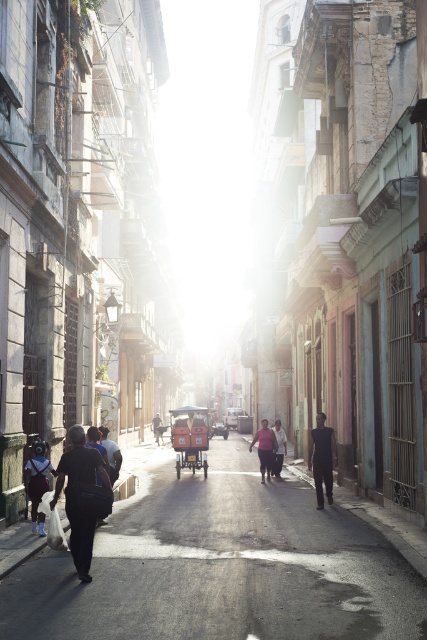
You are a delivery person with a 1 meter wide cart. You need to navigate through the narrow street between the black matte jacket at lower left and the dark gray fabric bag at center. Can your cart fit through the space between them?

The black matte jacket at lower left is narrower than the dark gray fabric bag at center. However, the exact width of the space between them isn